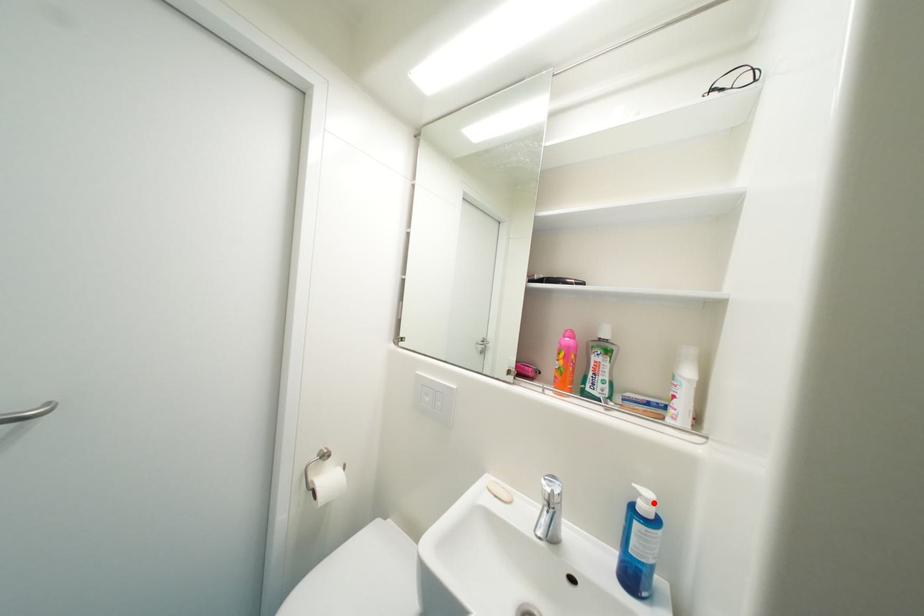
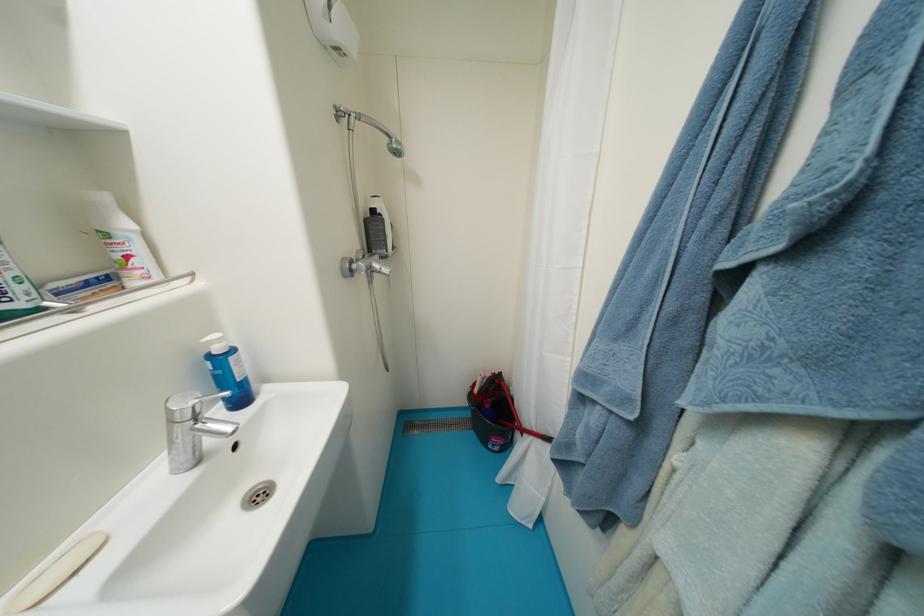
In the second image, find the point that corresponds to the highlighted location in the first image.

(225, 342)